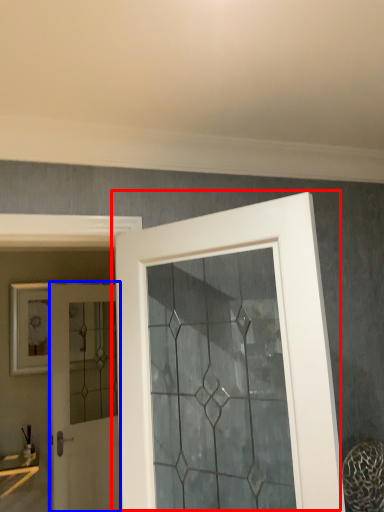
Question: Which of the following is the farthest to the observer, door (highlighted by a red box) or door (highlighted by a blue box)?

Choices:
 (A) door
 (B) door

Answer: (B)